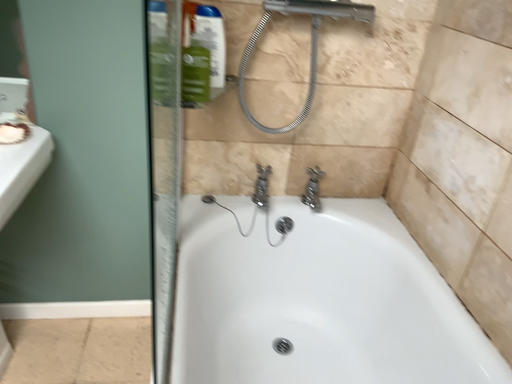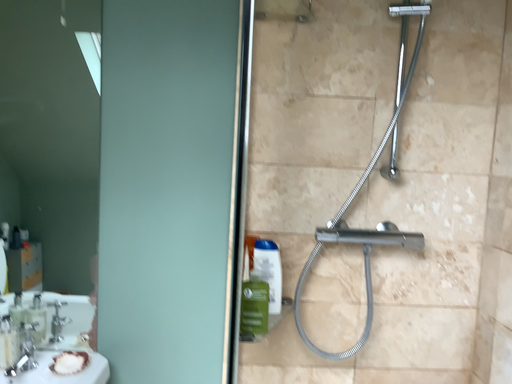
Question: How did the camera likely rotate when shooting the video?

Choices:
 (A) rotated upward
 (B) rotated downward

Answer: (A)